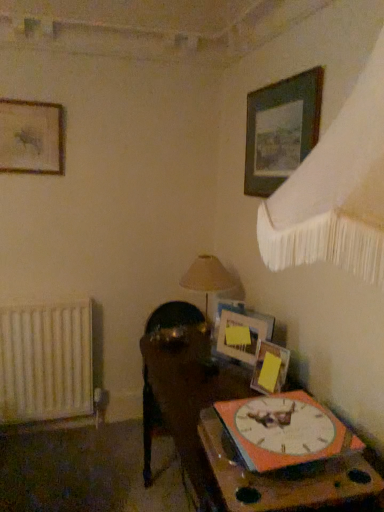
Question: Does white matte radiator at left have a greater width compared to beige fabric lampshade at center?

Choices:
 (A) yes
 (B) no

Answer: (B)

Question: From a real-world perspective, is white matte radiator at left positioned over beige fabric lampshade at center based on gravity?

Choices:
 (A) no
 (B) yes

Answer: (A)

Question: From the image's perspective, would you say white matte radiator at left is shown under beige fabric lampshade at center?

Choices:
 (A) yes
 (B) no

Answer: (A)

Question: Is white matte radiator at left oriented towards beige fabric lampshade at center?

Choices:
 (A) no
 (B) yes

Answer: (A)

Question: Can you confirm if white matte radiator at left is bigger than beige fabric lampshade at center?

Choices:
 (A) no
 (B) yes

Answer: (B)

Question: Is point 274,356 closer or farther from the camera than point 296,456?

Choices:
 (A) farther
 (B) closer

Answer: (A)

Question: In terms of width, does wooden picture frame at center, which is counted as the 3th picture frame, starting from the left, look wider or thinner when compared to orange matte wall clock at lower right?

Choices:
 (A) wide
 (B) thin

Answer: (B)

Question: Is wooden picture frame at center, which is counted as the 3th picture frame, starting from the left, taller or shorter than orange matte wall clock at lower right?

Choices:
 (A) short
 (B) tall

Answer: (B)

Question: From a real-world perspective, is wooden picture frame at center, which ranks as the second picture frame in right-to-left order, above or below orange matte wall clock at lower right?

Choices:
 (A) above
 (B) below

Answer: (B)

Question: Is orange matte wall clock at lower right bigger or smaller than wooden clock at lower right, acting as the 2th table starting from the bottom?

Choices:
 (A) small
 (B) big

Answer: (A)

Question: Is orange matte wall clock at lower right in front of or behind wooden clock at lower right, which is counted as the 1th table, starting from the top, in the image?

Choices:
 (A) behind
 (B) front

Answer: (A)

Question: Is point (297, 455) positioned closer to the camera than point (248, 498)?

Choices:
 (A) closer
 (B) farther

Answer: (B)

Question: Looking at their shapes, would you say orange matte wall clock at lower right is wider or thinner than wooden clock at lower right, which is counted as the 1th table, starting from the top?

Choices:
 (A) wide
 (B) thin

Answer: (B)

Question: From a real-world perspective, is beige fabric lampshade at center above or below orange matte wall clock at lower right?

Choices:
 (A) below
 (B) above

Answer: (B)

Question: Considering the relative positions of beige fabric lampshade at center and orange matte wall clock at lower right in the image provided, is beige fabric lampshade at center to the left or to the right of orange matte wall clock at lower right?

Choices:
 (A) right
 (B) left

Answer: (B)